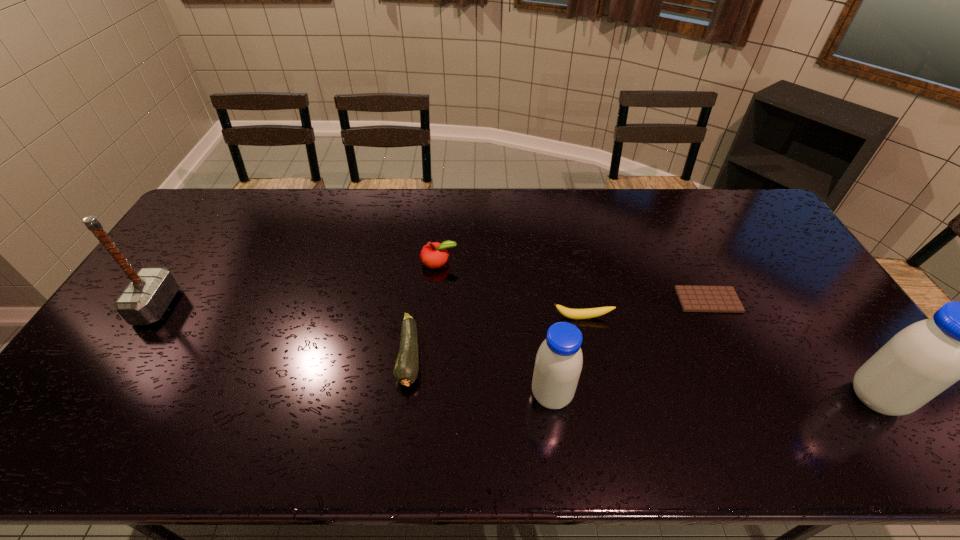
You are a GUI agent. You are given a task and a screenshot of the screen. Output one action in this format:
    pyautogui.click(x=<x>, y=<y>)
    Task: Click on the zucchini
    
    Given the screenshot: What is the action you would take?
    point(406,369)

This screenshot has height=540, width=960. Identify the location of vacant region located on the right of the shorter soya milk. (637, 395).

Locate an element on the screen. The height and width of the screenshot is (540, 960). free region located on the left of the taller soya milk is located at coordinates click(740, 397).

This screenshot has width=960, height=540. Find the location of `vacant space situated on the right of the apple`. vacant space situated on the right of the apple is located at coordinates (519, 262).

The image size is (960, 540). I want to click on vacant space located on the striking surface of the hammer, so click(220, 306).

Identify the location of vacant area located on the upward curve of the banana. click(x=591, y=360).

Identify the location of blank space located 0.280m on the front of the shortest object. The image size is (960, 540). (756, 401).

Find the location of `zucchini that is at the near edge`. zucchini that is at the near edge is located at coordinates (406, 369).

Where is `object at the left edge`? object at the left edge is located at coordinates (150, 291).

Find the location of a particular element. This screenshot has width=960, height=540. object positioned at the right edge is located at coordinates (921, 361).